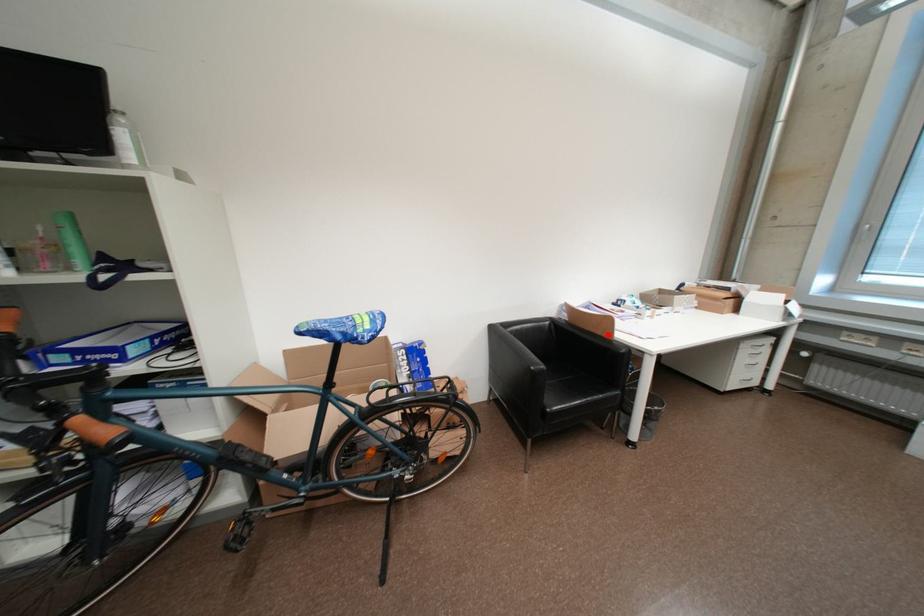
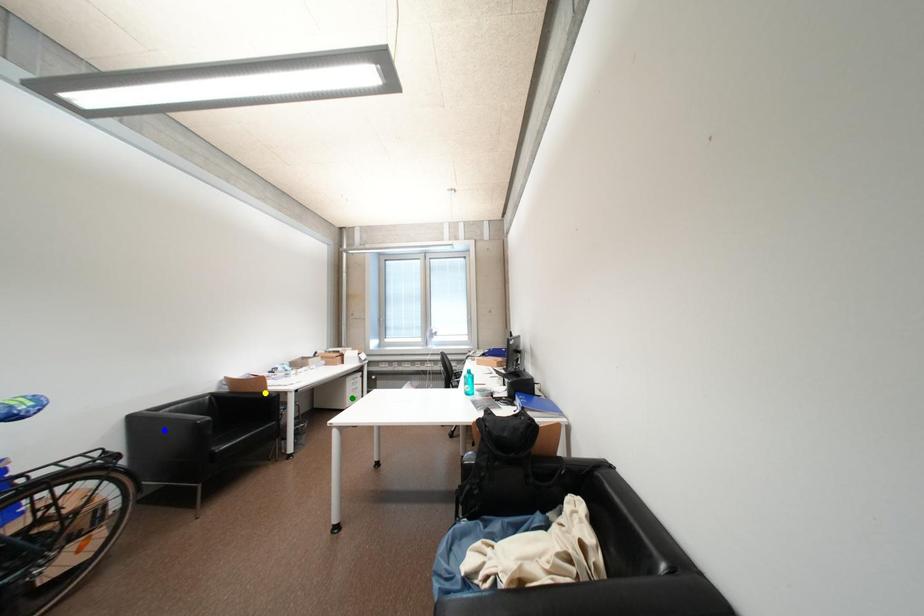
Question: I am providing you with two images of the same scene from different viewpoints. A red point is marked on the first image. You are given multiple points on the second image. Can you choose the point in image 2 that corresponds to the point in image 1?

Choices:
 (A) blue point
 (B) green point
 (C) yellow point

Answer: (C)